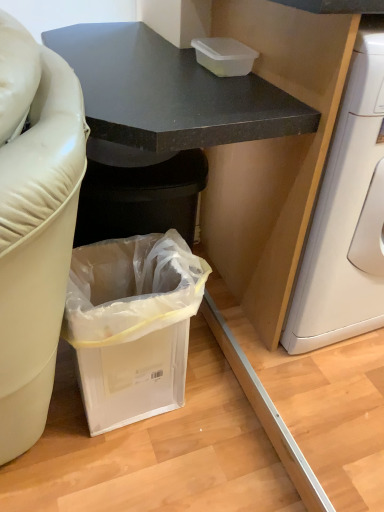
Find the location of a particular element. free space in front of transparent plastic container at upper center is located at coordinates (226, 86).